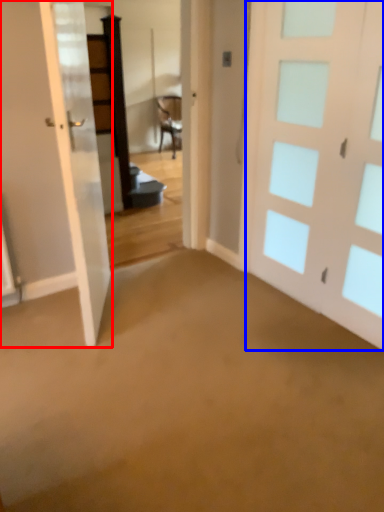
Question: Which point is further to the camera, door (highlighted by a red box) or door (highlighted by a blue box)?

Choices:
 (A) door
 (B) door

Answer: (B)